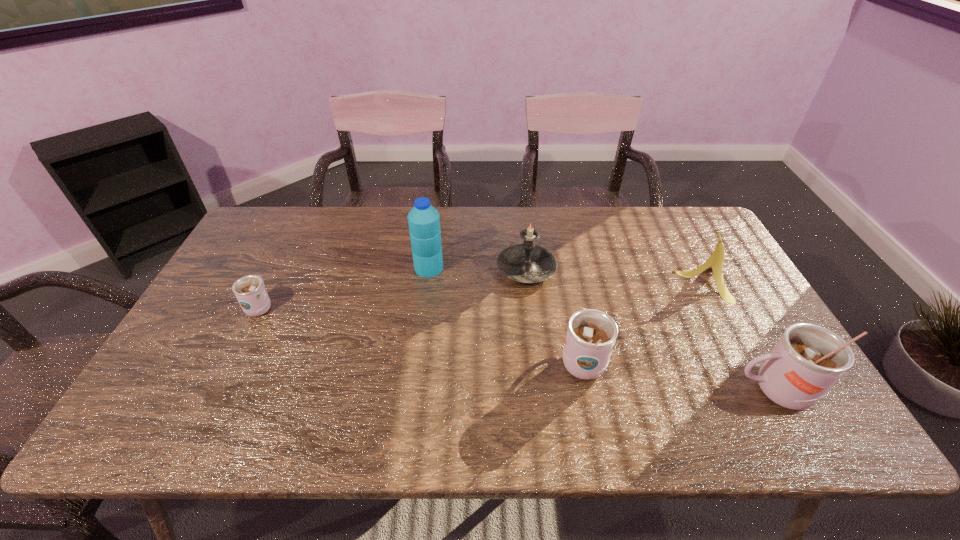
I want to click on object that is at the left edge, so click(250, 292).

At what (x,y) coordinates should I click in order to perform the action: click on cup that is at the right edge. Please return your answer as a coordinate pair (x, y). The height and width of the screenshot is (540, 960). Looking at the image, I should click on (808, 359).

The width and height of the screenshot is (960, 540). Identify the location of banana that is at the right edge. (715, 262).

Where is `object situated at the near right corner`? The height and width of the screenshot is (540, 960). object situated at the near right corner is located at coordinates (808, 359).

Where is `free location at the far edge`? This screenshot has width=960, height=540. free location at the far edge is located at coordinates coord(622,245).

You are a GUI agent. You are given a task and a screenshot of the screen. Output one action in this format:
    pyautogui.click(x=<x>, y=<y>)
    Task: Click on the free region at the near edge
    This screenshot has width=960, height=540.
    Given the screenshot: What is the action you would take?
    click(x=350, y=384)

This screenshot has height=540, width=960. In the image, there is a desktop. Identify the location of free region at the left edge. [x=278, y=264].

Locate an element on the screen. The height and width of the screenshot is (540, 960). vacant space at the right edge of the desktop is located at coordinates (745, 292).

The height and width of the screenshot is (540, 960). What are the coordinates of `vacant space at the far right corner of the desktop` in the screenshot? It's located at (655, 209).

Where is `empty space that is in between the leftmost object and the rightmost cup`? Image resolution: width=960 pixels, height=540 pixels. empty space that is in between the leftmost object and the rightmost cup is located at coordinates (517, 348).